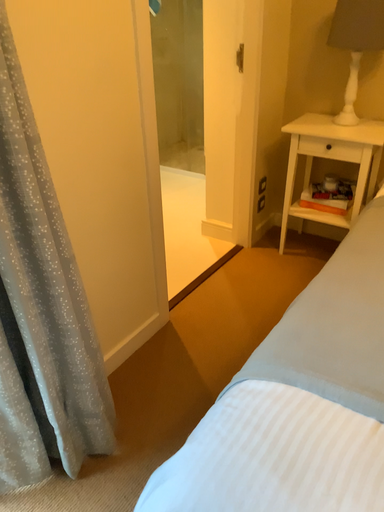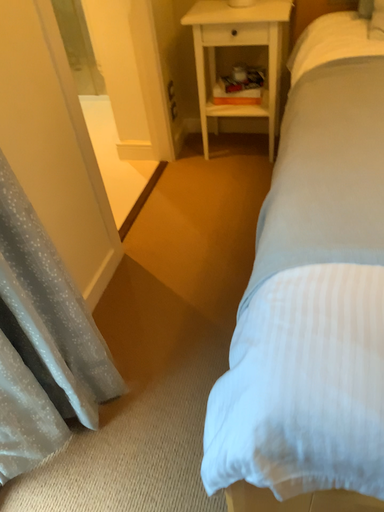
Question: How did the camera likely rotate when shooting the video?

Choices:
 (A) rotated upward
 (B) rotated downward

Answer: (B)